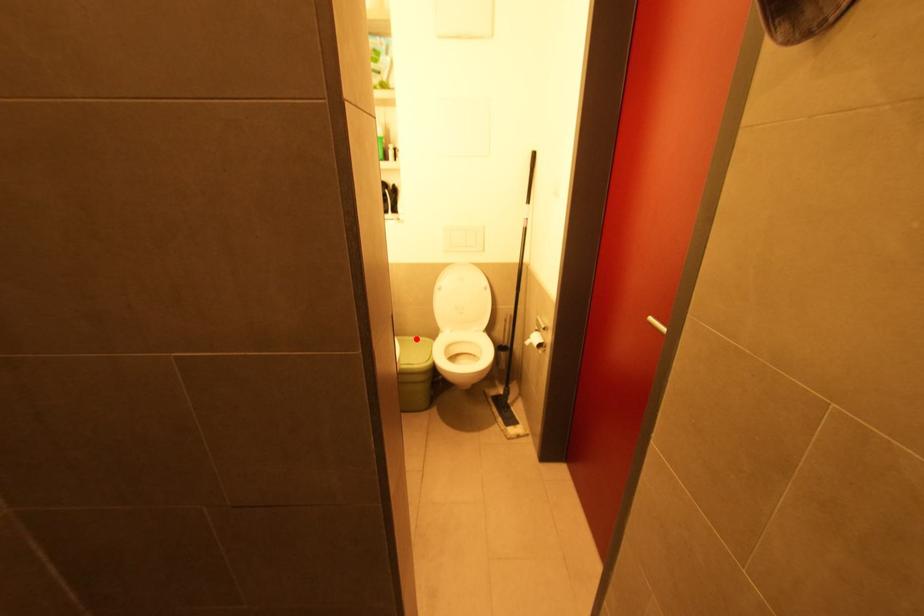
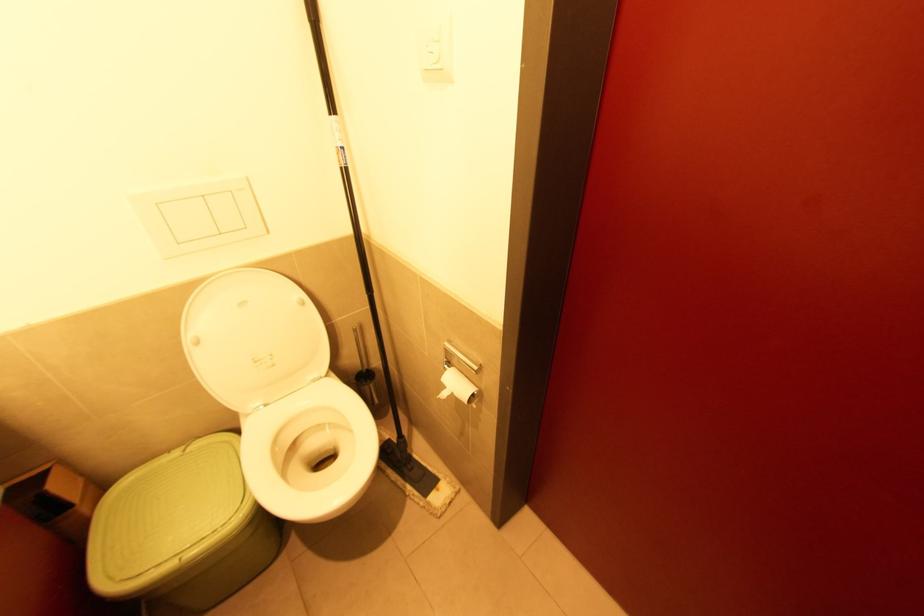
Find the pixel in the second image that matches the highlighted location in the first image.

(187, 452)